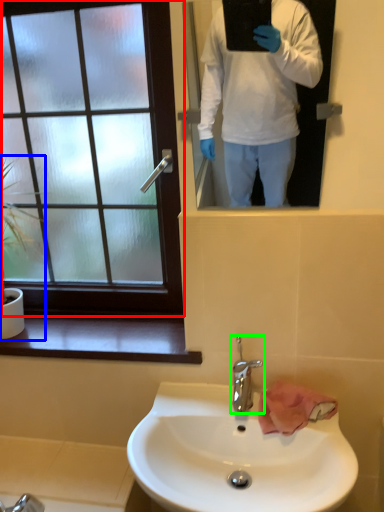
Question: Which is farther away from window (highlighted by a red box)? houseplant (highlighted by a blue box) or tap (highlighted by a green box)?

Choices:
 (A) houseplant
 (B) tap

Answer: (B)